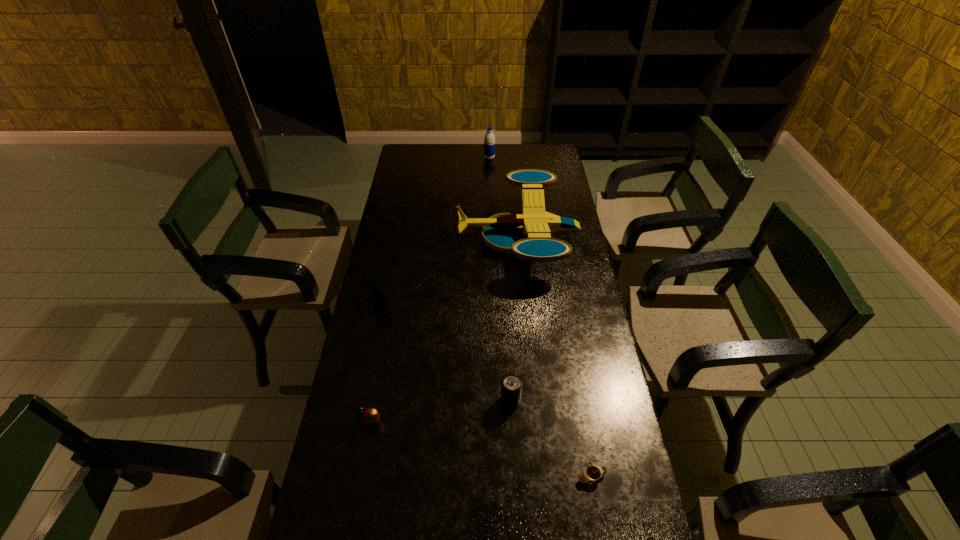
In order to click on free location located at the cockpit of the second farthest object in this screenshot , I will do `click(408, 239)`.

Locate an element on the screen. This screenshot has width=960, height=540. free location located 0.090m at the cockpit of the second farthest object is located at coordinates (436, 239).

Locate an element on the screen. The image size is (960, 540). free location located on the face of the Lego is located at coordinates (369, 357).

The height and width of the screenshot is (540, 960). I want to click on vacant space situated 0.220m on the right of the fourth farthest object, so click(x=591, y=401).

The image size is (960, 540). I want to click on free space located on the front-facing side of the fifth tallest object, so click(x=351, y=525).

In order to click on vacant region located 0.340m on the back of the nearest object in this screenshot , I will do (572, 363).

I want to click on object located in the far edge section of the desktop, so click(x=489, y=140).

Locate an element on the screen. Image resolution: width=960 pixels, height=540 pixels. Lego situated at the left edge is located at coordinates (376, 296).

This screenshot has height=540, width=960. What are the coordinates of `alarm clock located at the left edge` in the screenshot? It's located at (366, 417).

Where is `drone that is at the right edge`? This screenshot has height=540, width=960. drone that is at the right edge is located at coordinates (527, 235).